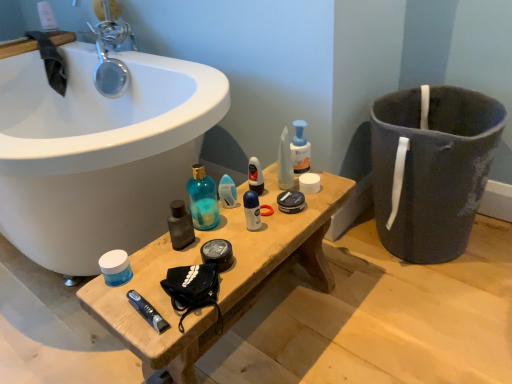
This screenshot has width=512, height=384. In order to click on vacant space that is to the left of translucent plastic bottle at center, the 1th mouthwash viewed from the back in this screenshot , I will do `click(267, 177)`.